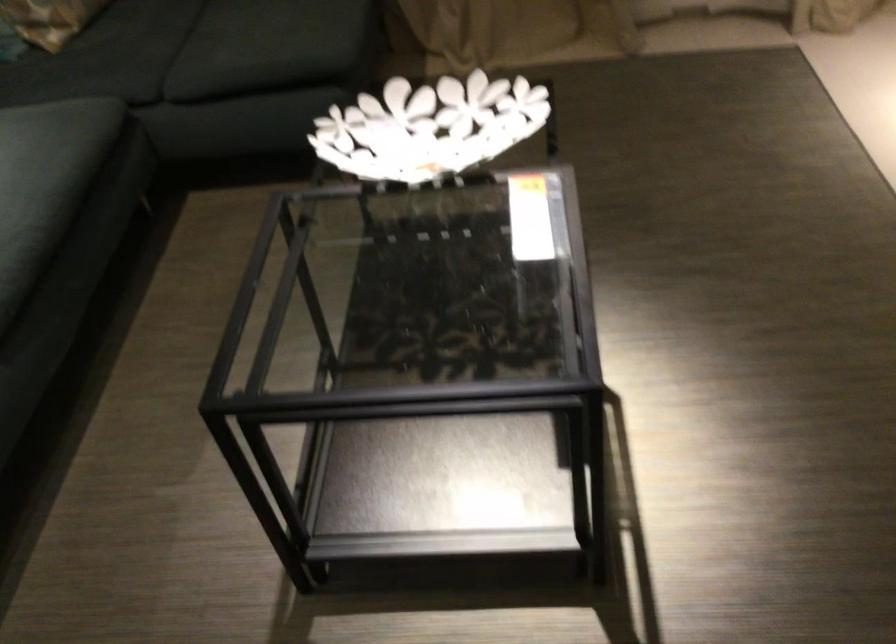
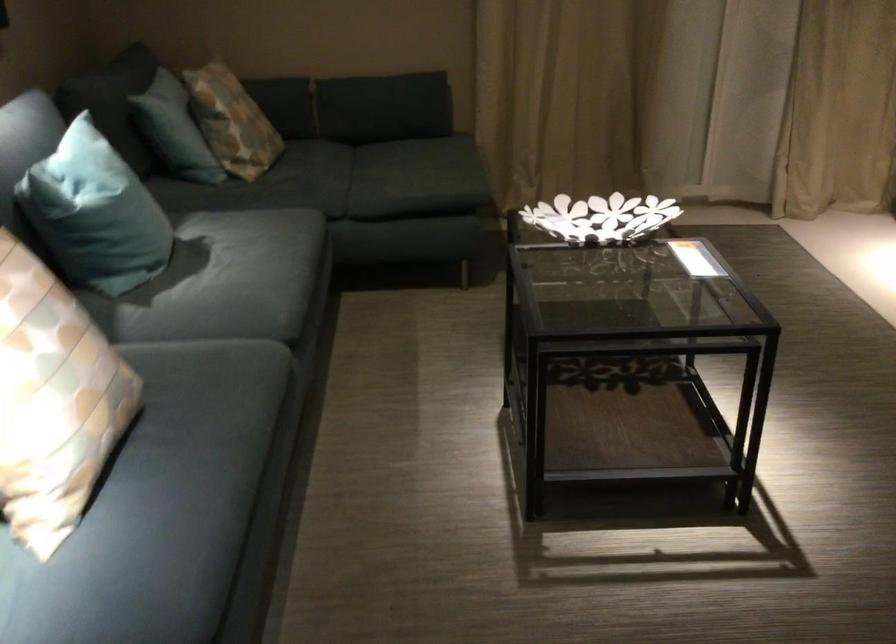
Locate, in the second image, the point that corresponds to (x=452, y=124) in the first image.

(600, 218)